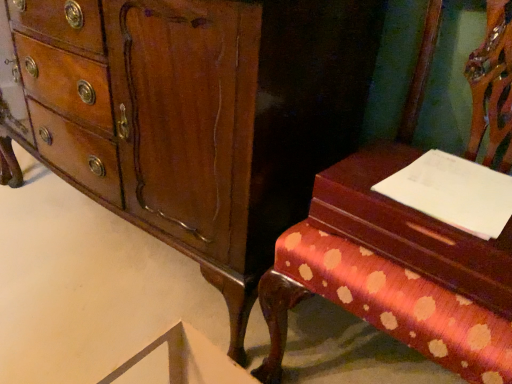
I want to click on vacant space situated above wooden vanity at right (from a real-world perspective), so click(x=430, y=193).